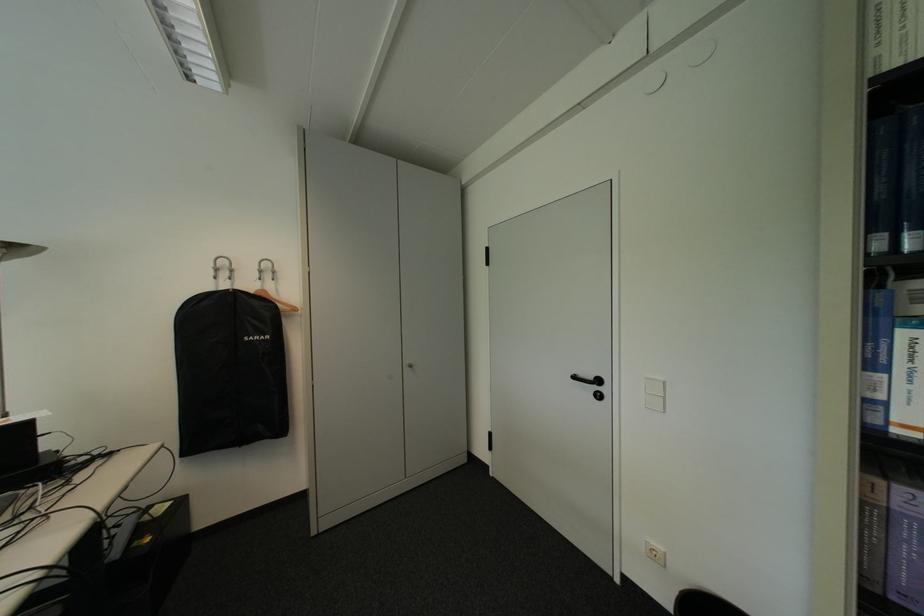
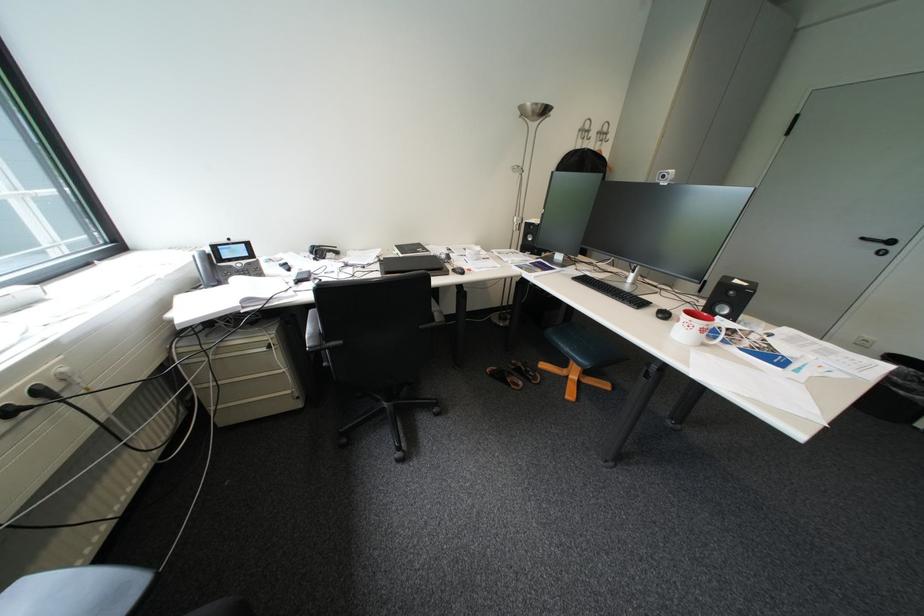
In the second image, find the point that corresponds to point 611,382 in the first image.

(904, 243)